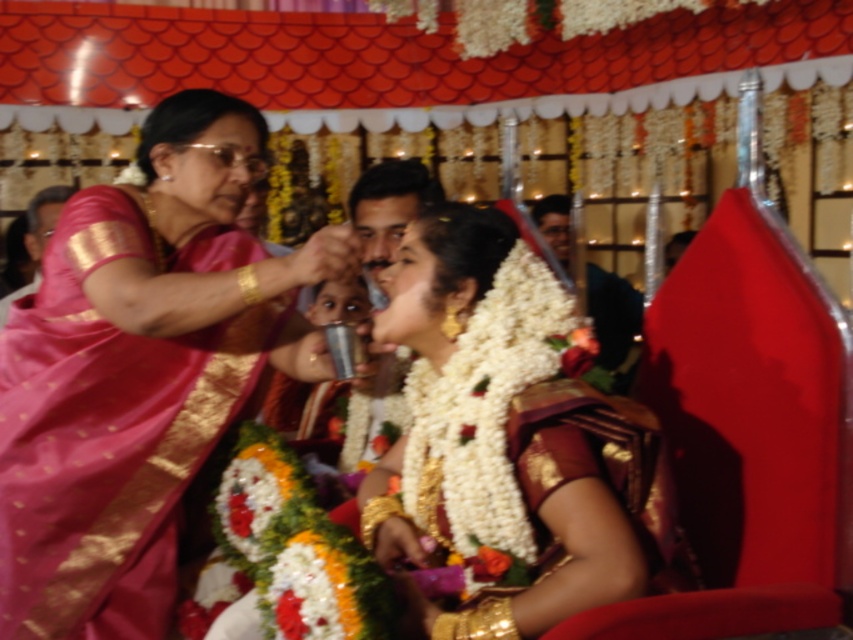
Question: Does white floral garland at center come behind dark green fabric at upper center?

Choices:
 (A) no
 (B) yes

Answer: (A)

Question: Where is white floral garland at center located in relation to dark green fabric at upper center in the image?

Choices:
 (A) left
 (B) right

Answer: (A)

Question: Which of the following is the closest to the observer?

Choices:
 (A) (445, 449)
 (B) (627, 344)

Answer: (A)

Question: Considering the relative positions of pink silk saree at upper left and white floral garland at center in the image provided, where is pink silk saree at upper left located with respect to white floral garland at center?

Choices:
 (A) below
 (B) above

Answer: (B)

Question: Based on their relative distances, which object is nearer to the pink silk saree at upper left?

Choices:
 (A) dark green fabric at upper center
 (B) white floral garland at center

Answer: (B)

Question: Among these points, which one is nearest to the camera?

Choices:
 (A) (625, 310)
 (B) (500, 577)

Answer: (B)